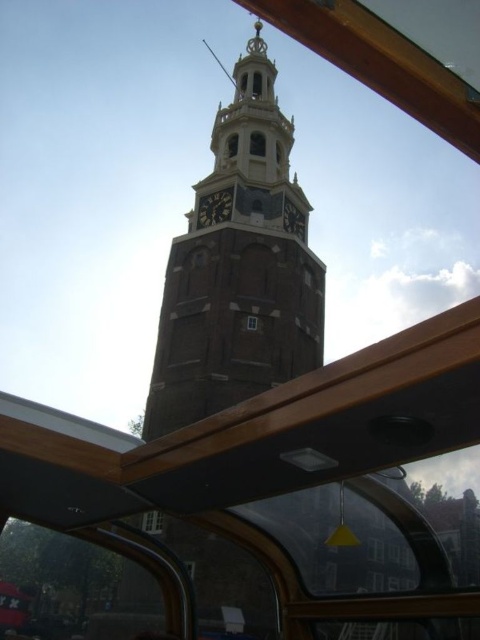
Question: Does brown brick tower at center have a lesser width compared to matte brown clock tower at upper center?

Choices:
 (A) no
 (B) yes

Answer: (A)

Question: Which object is farther from the camera taking this photo?

Choices:
 (A) transparent glass window at center
 (B) clear glass window at center
 (C) brown brick tower at center
 (D) matte glass clock tower at upper center

Answer: (D)

Question: Observing the image, what is the correct spatial positioning of dark brown wooden clock at center in reference to matte glass clock tower at upper center?

Choices:
 (A) above
 (B) below

Answer: (B)

Question: Which point is farther to the camera?

Choices:
 (A) (273, 358)
 (B) (156, 516)
 (C) (262, 134)
 (D) (222, 195)

Answer: (C)

Question: Which of the following is the closest to the observer?

Choices:
 (A) (218, 216)
 (B) (276, 364)
 (C) (252, 323)

Answer: (B)

Question: Can you confirm if matte glass clock tower at upper center is thinner than clear glass window at center?

Choices:
 (A) yes
 (B) no

Answer: (B)